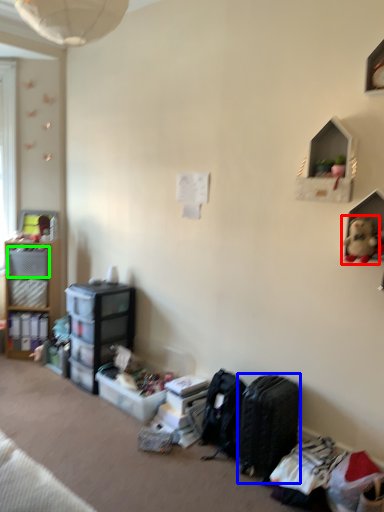
Question: Which object is positioned closest to toy (highlighted by a red box)? Select from luggage (highlighted by a blue box) and storage box (highlighted by a green box).

Choices:
 (A) luggage
 (B) storage box

Answer: (A)